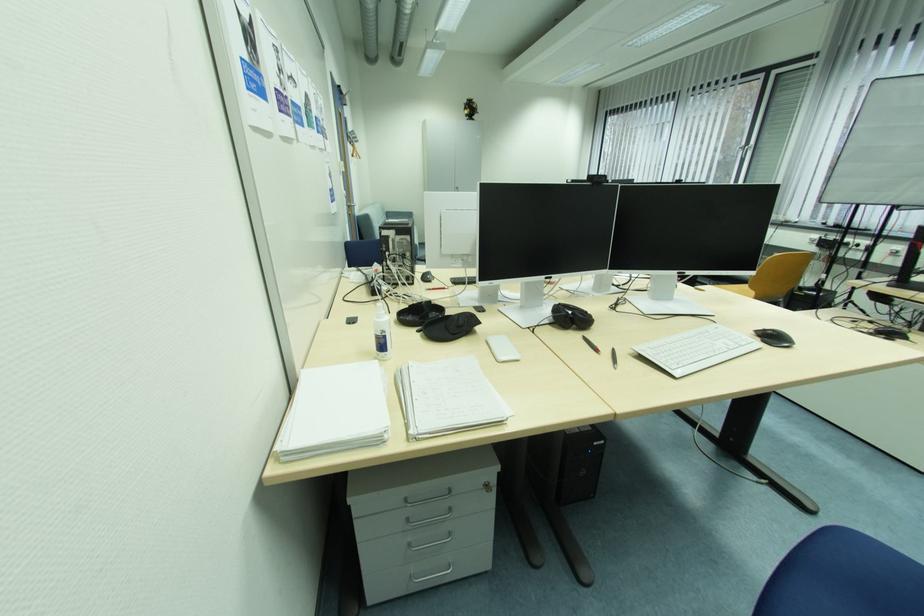
Image resolution: width=924 pixels, height=616 pixels. What do you see at coordinates (450, 326) in the screenshot? I see `a black glasses case` at bounding box center [450, 326].